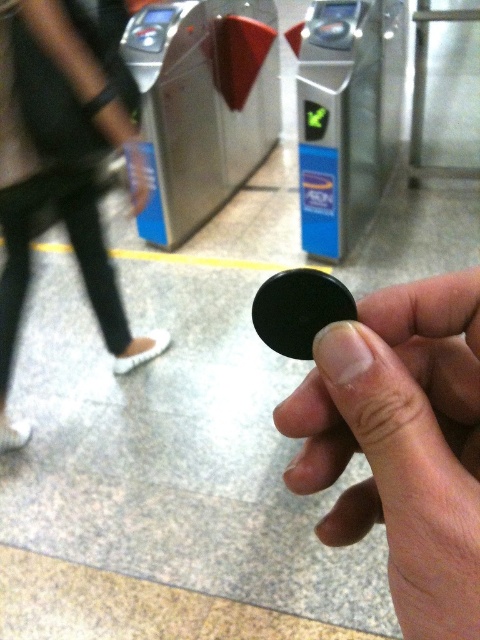
You are at a subway station and see a black matte coin at center and black leather pants at lower left. Which object is positioned more to the right side?

The black matte coin at center is positioned to the right of the black leather pants at lower left.

You are at a subway station and notice a black matte coin at center and black leather pants at lower left. Which object is smaller in size?

The black matte coin at center is smaller than the black leather pants at lower left.

You are a delivery robot with a height of 1.6 meters. You need to navigate through the subway station shown in the image. There is a black matte coin at center and black leather pants at lower left in your path. Will you be able to pass between them without bending down?

The distance between the black matte coin at center and black leather pants at lower left is 1.58 meters. Since the robot is 1.6 meters tall, it will need to bend down as the space is slightly shorter than its height.